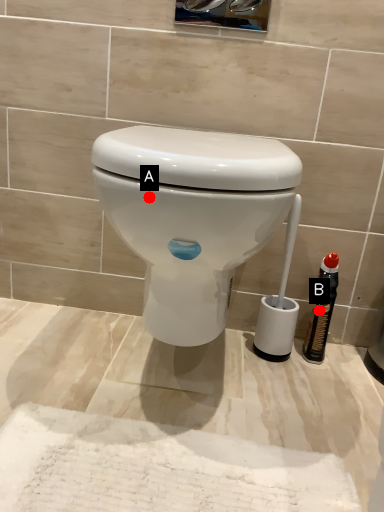
Question: Two points are circled on the image, labeled by A and B beside each circle. Among these points, which one is farthest from the camera?

Choices:
 (A) A is further
 (B) B is further

Answer: (B)